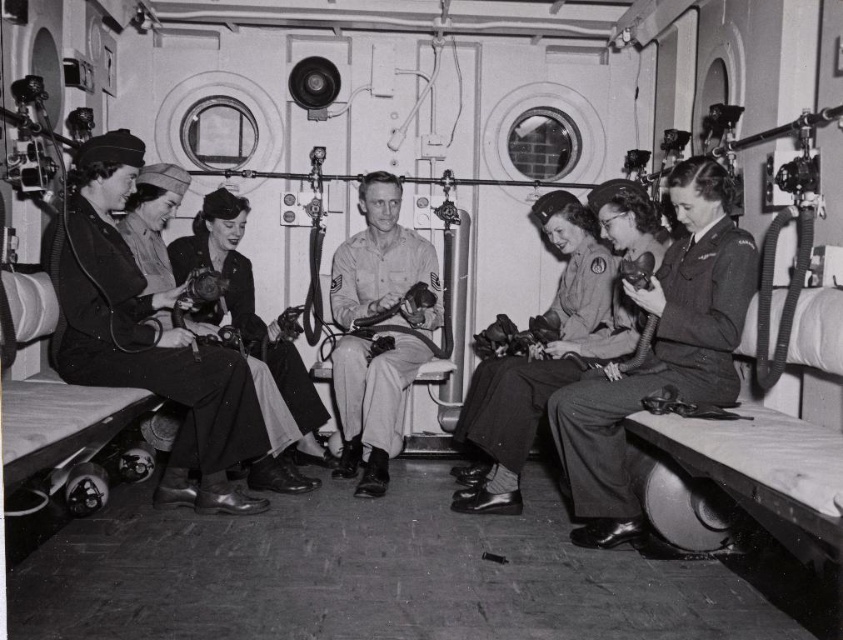
Does smooth khaki uniform at center have a larger size compared to khaki cotton shirt at center?

Incorrect, smooth khaki uniform at center is not larger than khaki cotton shirt at center.

Which is behind, point (589, 444) or point (503, 369)?

The point (503, 369) is more distant.

This screenshot has width=843, height=640. Identify the location of smooth khaki uniform at center. (659, 353).

Is khaki uniform at center smaller than khaki cotton shirt at center?

Yes, khaki uniform at center is smaller than khaki cotton shirt at center.

Can you confirm if khaki uniform at center is thinner than khaki cotton shirt at center?

Indeed, khaki uniform at center has a lesser width compared to khaki cotton shirt at center.

Is point (353, 349) positioned behind point (462, 502)?

Yes.

At what (x,y) coordinates should I click in order to perform the action: click on khaki uniform at center. Please return your answer as a coordinate pair (x, y). Looking at the image, I should click on (379, 332).

Does point (352, 445) lie in front of point (244, 269)?

Yes, point (352, 445) is in front of point (244, 269).

Is khaki uniform at center positioned behind matte black uniform at center?

Yes.

This screenshot has height=640, width=843. What are the coordinates of `khaki uniform at center` in the screenshot? It's located at (379, 332).

Where is `khaki uniform at center`? The width and height of the screenshot is (843, 640). khaki uniform at center is located at coordinates (379, 332).